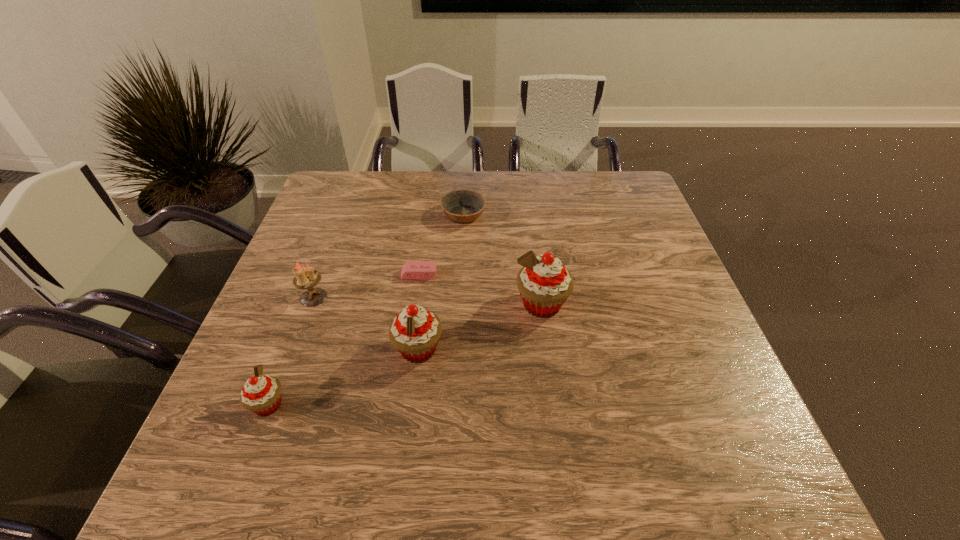
Find the location of `candle holder that is at the left edge`. candle holder that is at the left edge is located at coordinates (305, 277).

Identify the location of object located in the near left corner section of the desktop. This screenshot has width=960, height=540. (261, 394).

Image resolution: width=960 pixels, height=540 pixels. In order to click on vacant region at the far edge of the desktop in this screenshot , I will do `click(567, 200)`.

The width and height of the screenshot is (960, 540). I want to click on free point at the near edge, so click(365, 394).

Locate an element on the screen. vacant space at the left edge is located at coordinates 360,221.

You are a GUI agent. You are given a task and a screenshot of the screen. Output one action in this format:
    pyautogui.click(x=<x>, y=<y>)
    Task: Click on the free spot at the right edge of the desktop
    
    Given the screenshot: What is the action you would take?
    pyautogui.click(x=662, y=277)

You are a GUI agent. You are given a task and a screenshot of the screen. Output one action in this format:
    pyautogui.click(x=<x>, y=<y>)
    Task: Click on the vacant area at the far right corner of the desktop
    
    Given the screenshot: What is the action you would take?
    pyautogui.click(x=627, y=172)

Where is `vacant region at the near right corner of the desktop`? Image resolution: width=960 pixels, height=540 pixels. vacant region at the near right corner of the desktop is located at coordinates (676, 427).

You are a GUI agent. You are given a task and a screenshot of the screen. Output one action in this format:
    pyautogui.click(x=<x>, y=<y>)
    Task: Click on the vacant space that is in between the candle holder and the bowl
    This screenshot has height=540, width=960.
    Given the screenshot: What is the action you would take?
    pyautogui.click(x=389, y=256)

You are a GUI agent. You are given a task and a screenshot of the screen. Output one action in this format:
    pyautogui.click(x=<x>, y=<y>)
    Task: Click on the vacant space that's between the eraser and the rightmost object
    
    Given the screenshot: What is the action you would take?
    click(480, 289)